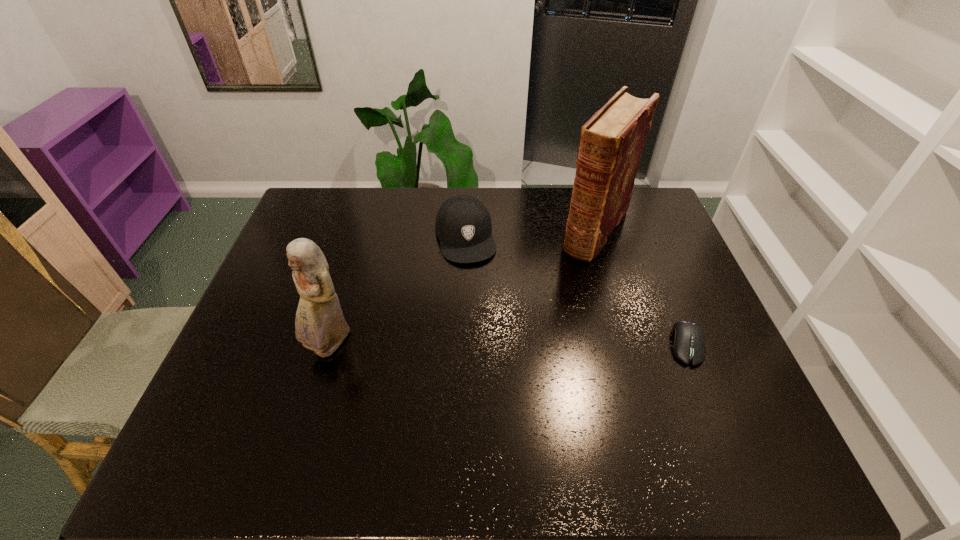
Where is `vacant spot on the desktop that is between the figurine and the shortest object and is positioned on the spine side of the hardback book`? vacant spot on the desktop that is between the figurine and the shortest object and is positioned on the spine side of the hardback book is located at coordinates (512, 345).

Locate an element on the screen. This screenshot has width=960, height=540. vacant spot on the desktop that is between the second tallest object and the shortest object and is positioned on the front-facing side of the second object from left to right is located at coordinates (492, 345).